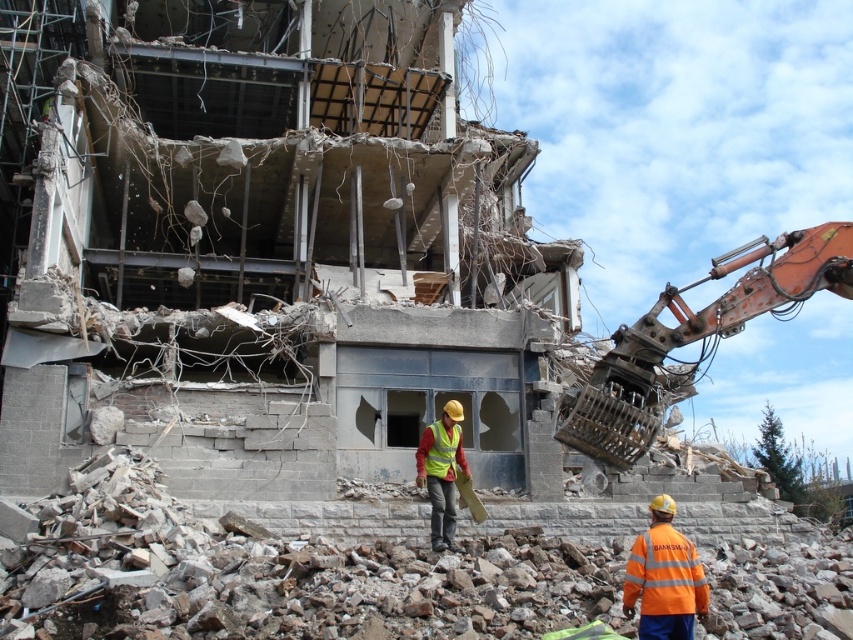
Question: Which point appears farthest from the camera in this image?

Choices:
 (A) (x=445, y=460)
 (B) (x=440, y=420)

Answer: (B)

Question: Is rusty metal excavator at right in front of reflective yellow vest at center?

Choices:
 (A) yes
 (B) no

Answer: (A)

Question: Considering the real-world distances, which object is closest to the orange reflective vest at lower right?

Choices:
 (A) reflective yellow vest at center
 (B) high visibility fabric safety vest at center
 (C) rusty metal excavator at right

Answer: (A)

Question: Considering the real-world distances, which object is closest to the orange reflective vest at lower right?

Choices:
 (A) high visibility fabric safety vest at center
 (B) rusty metal excavator at right

Answer: (A)

Question: Does reflective yellow vest at center appear over high visibility fabric safety vest at center?

Choices:
 (A) no
 (B) yes

Answer: (A)

Question: Considering the relative positions of orange reflective vest at lower right and reflective yellow vest at center in the image provided, where is orange reflective vest at lower right located with respect to reflective yellow vest at center?

Choices:
 (A) right
 (B) left

Answer: (A)